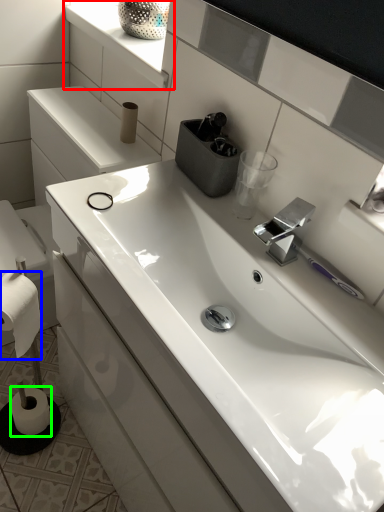
Question: Which is farther away from window sill (highlighted by a red box)? toilet paper (highlighted by a blue box) or toilet paper (highlighted by a green box)?

Choices:
 (A) toilet paper
 (B) toilet paper

Answer: (B)